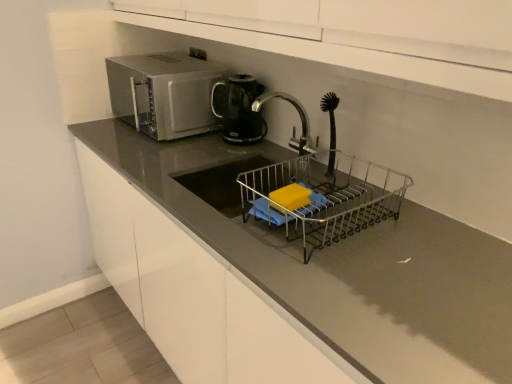
Where is `vacant region above matte gray countertop at center (from a real-world perspective)`? vacant region above matte gray countertop at center (from a real-world perspective) is located at coordinates (245, 199).